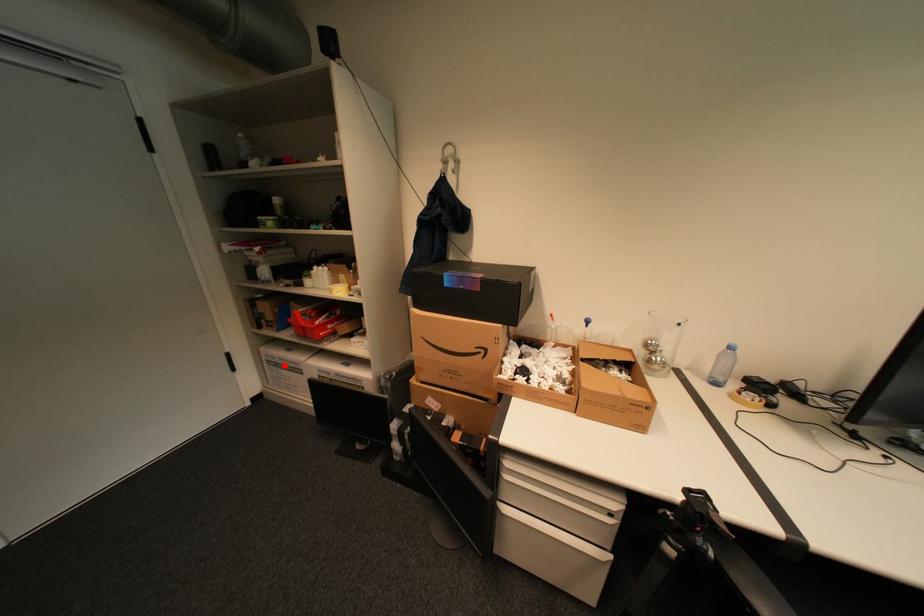
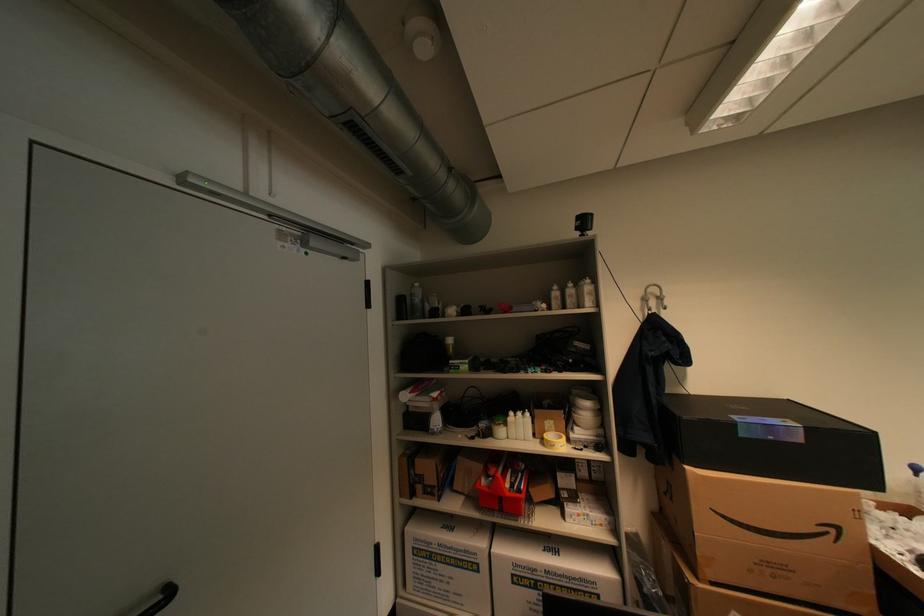
Find the pixel in the second image that matches the highlighted location in the first image.

(439, 556)